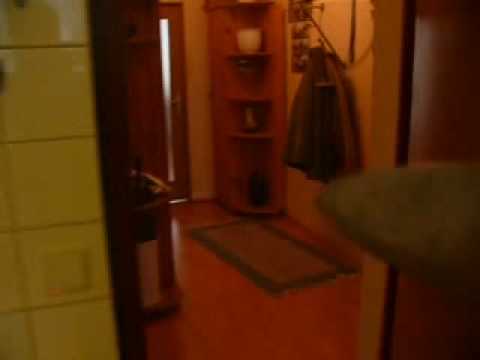
The image size is (480, 360). I want to click on shelf, so click(x=233, y=100).